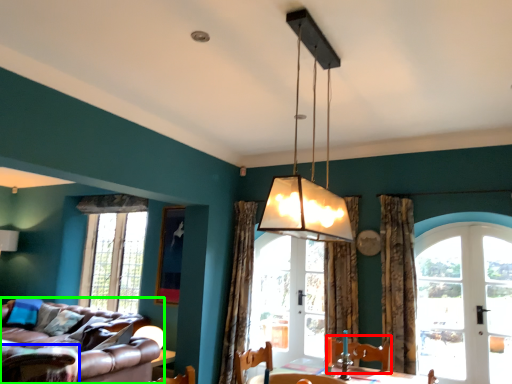
Question: Which is farther away from swivel chair (highlighted by a red box)? swivel chair (highlighted by a blue box) or studio couch (highlighted by a green box)?

Choices:
 (A) swivel chair
 (B) studio couch

Answer: (A)